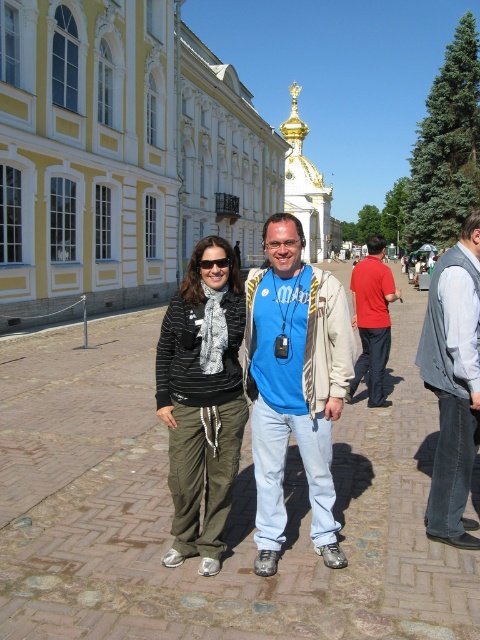
Question: Which object is positioned closest to the gray fabric vest at right?

Choices:
 (A) striped fabric scarf at center
 (B) blue fabric shirt at center
 (C) red cotton shirt at center

Answer: (B)

Question: Can you confirm if blue fabric shirt at center is thinner than gray fabric vest at right?

Choices:
 (A) yes
 (B) no

Answer: (B)

Question: Which object appears farthest from the camera in this image?

Choices:
 (A) gray fabric vest at right
 (B) striped fabric scarf at center

Answer: (A)

Question: Observing the image, what is the correct spatial positioning of blue fabric shirt at center in reference to gray fabric vest at right?

Choices:
 (A) below
 (B) above

Answer: (A)

Question: Does blue fabric shirt at center appear on the left side of striped fabric scarf at center?

Choices:
 (A) yes
 (B) no

Answer: (B)

Question: Among these points, which one is nearest to the camera?

Choices:
 (A) (457, 339)
 (B) (371, 272)

Answer: (A)